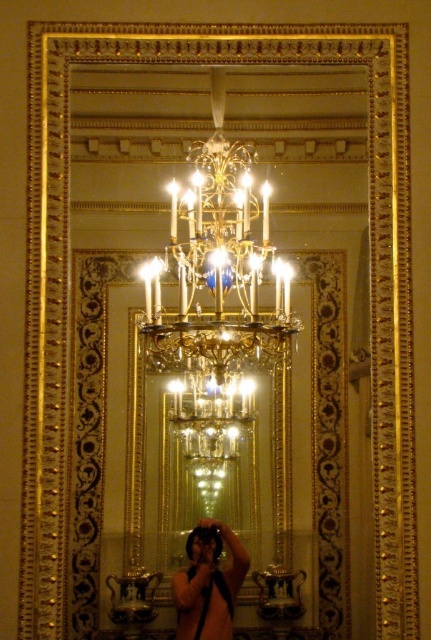
Between gold/glass chandelier at center and matte black camera at center, which one appears on the left side from the viewer's perspective?

Positioned to the left is matte black camera at center.

Can you confirm if gold/glass chandelier at center is taller than matte black camera at center?

Correct, gold/glass chandelier at center is much taller as matte black camera at center.

Which is behind, point (253, 337) or point (206, 604)?

The point (206, 604) is more distant.

At what (x,y) coordinates should I click in order to perform the action: click on gold/glass chandelier at center. Please return your answer as a coordinate pair (x, y). The width and height of the screenshot is (431, 640). Looking at the image, I should click on (218, 268).